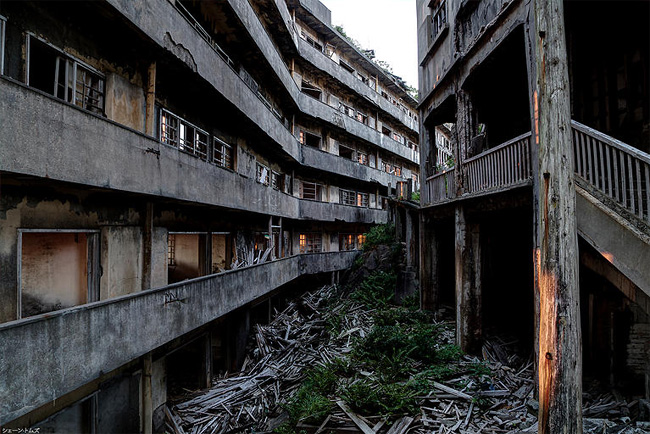
Find the location of `windows`. windows is located at coordinates (43, 69), (188, 138), (311, 141), (343, 151), (92, 79).